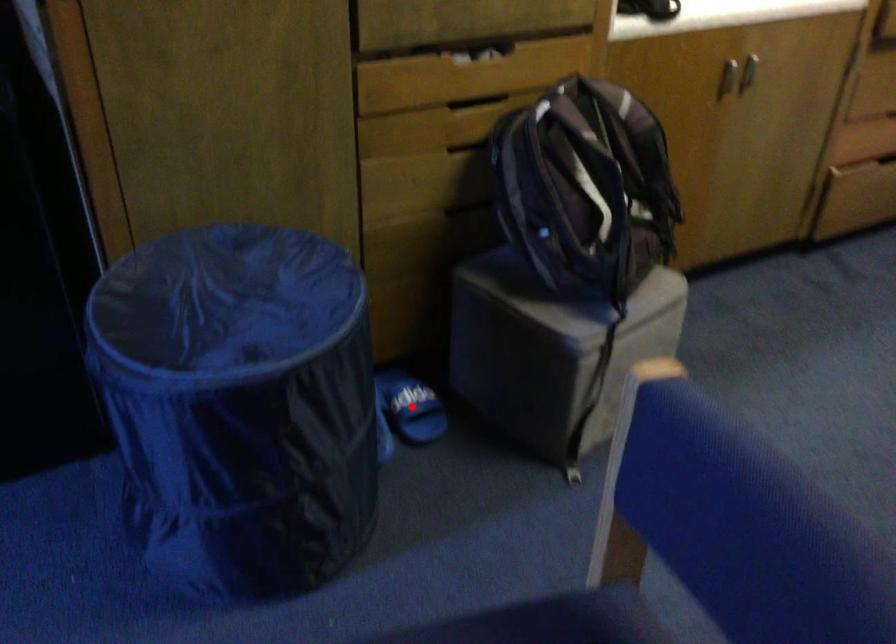
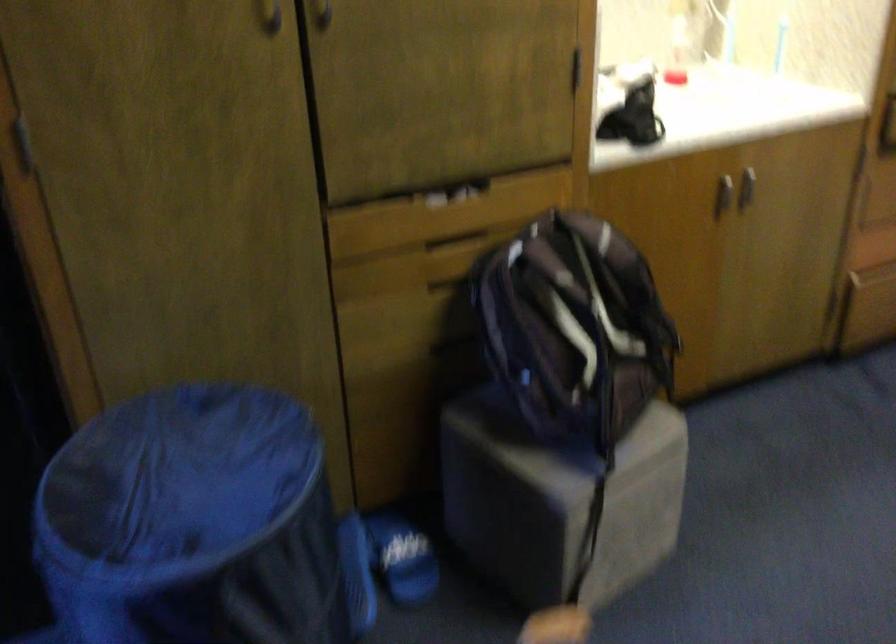
Locate, in the second image, the point that corresponds to the highlighted location in the first image.

(401, 558)